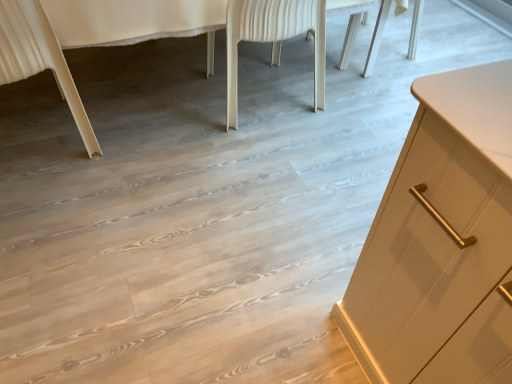
Locate an element on the screen. The image size is (512, 384). spots to the right of white wood chair at center, marked as the 1th chair in a right-to-left arrangement is located at coordinates (349, 109).